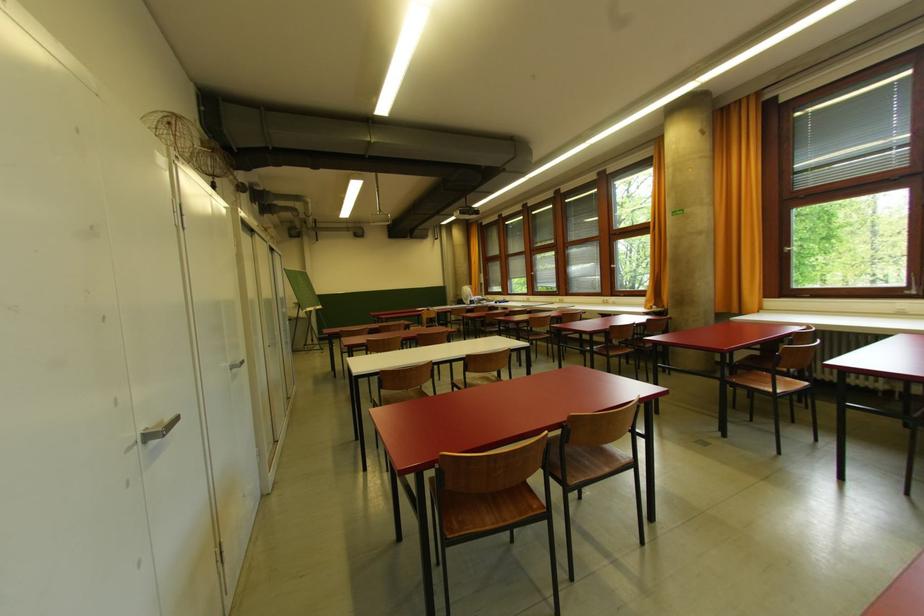
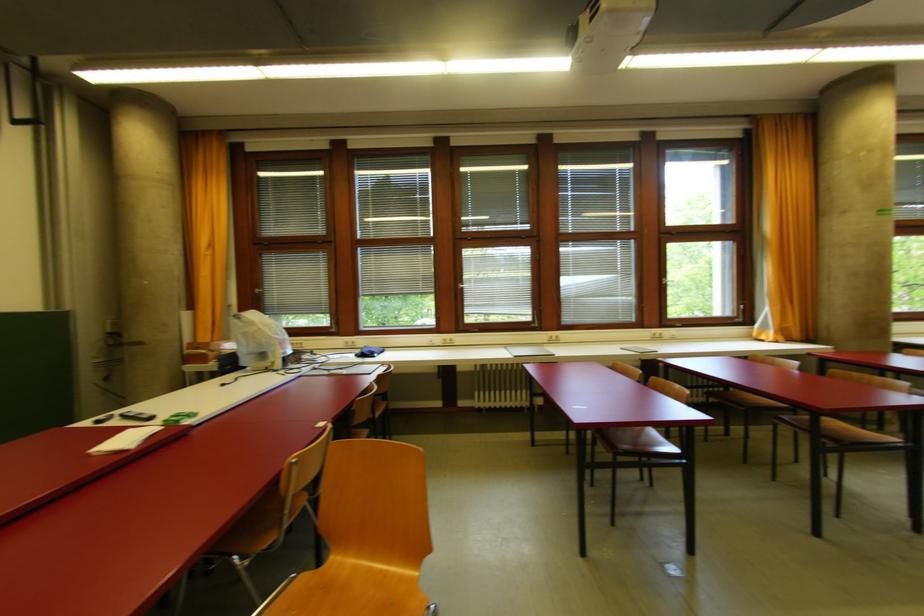
Find the pixel in the second image that matches the point at 564,302 in the first image.

(556, 339)